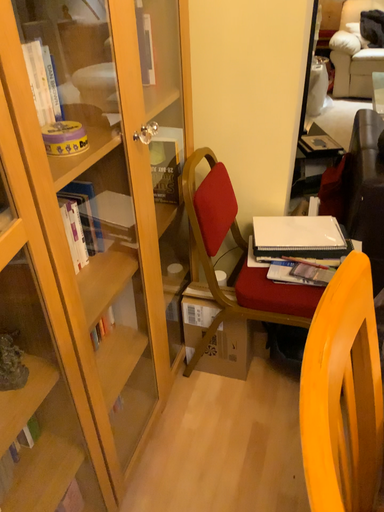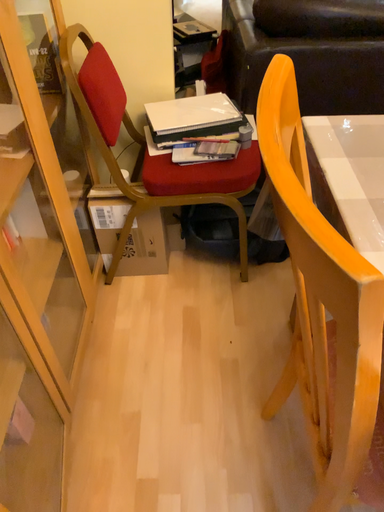
Question: Which way did the camera rotate in the video?

Choices:
 (A) rotated right
 (B) rotated left

Answer: (A)